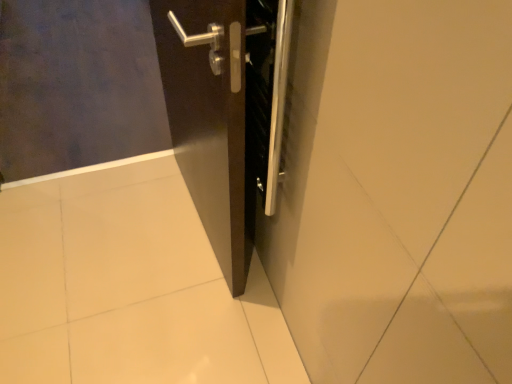
What is the approximate width of matte dark brown door at left?

The width of matte dark brown door at left is 2.18 meters.

This screenshot has width=512, height=384. What do you see at coordinates (77, 85) in the screenshot?
I see `matte dark brown door at left` at bounding box center [77, 85].

Find the location of a particular element. The width and height of the screenshot is (512, 384). matte dark brown door at left is located at coordinates (77, 85).

At what (x,y) coordinates should I click in order to perform the action: click on matte dark brown door at left. Please return your answer as a coordinate pair (x, y). Looking at the image, I should click on (x=77, y=85).